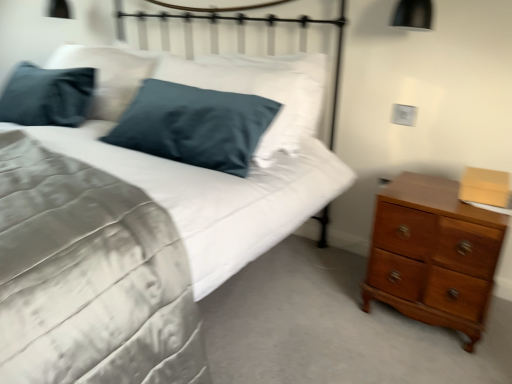
Question: Does point (172, 266) appear closer or farther from the camera than point (422, 23)?

Choices:
 (A) farther
 (B) closer

Answer: (B)

Question: Considering the positions of satin blue pillow at upper left and black matte lampshade at upper right in the image, is satin blue pillow at upper left bigger or smaller than black matte lampshade at upper right?

Choices:
 (A) small
 (B) big

Answer: (B)

Question: Estimate the real-world distances between objects in this image. Which object is closer to the shiny brown wooden chest of drawers at right?

Choices:
 (A) satin blue pillow at upper left
 (B) black matte lampshade at upper right
 (C) metallic white headboard at upper center

Answer: (A)

Question: Based on their relative distances, which object is farther from the satin blue pillow at upper left?

Choices:
 (A) black matte lampshade at upper right
 (B) metallic white headboard at upper center
 (C) shiny brown wooden chest of drawers at right

Answer: (A)